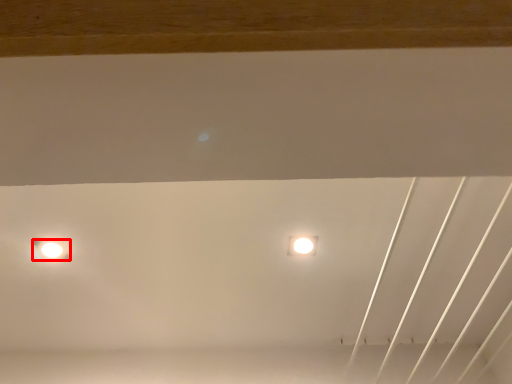
Question: From the image's perspective, what is the correct spatial positioning of lamp (annotated by the red box) in reference to lamp?

Choices:
 (A) below
 (B) above

Answer: (A)